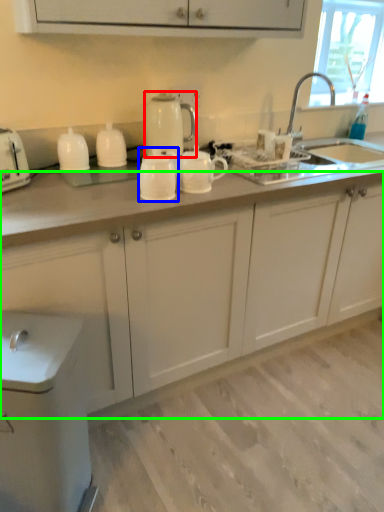
Question: Estimate the real-world distances between objects in this image. Which object is closer to kitchen appliance (highlighted by a red box), tableware (highlighted by a blue box) or cabinetry (highlighted by a green box)?

Choices:
 (A) tableware
 (B) cabinetry

Answer: (A)